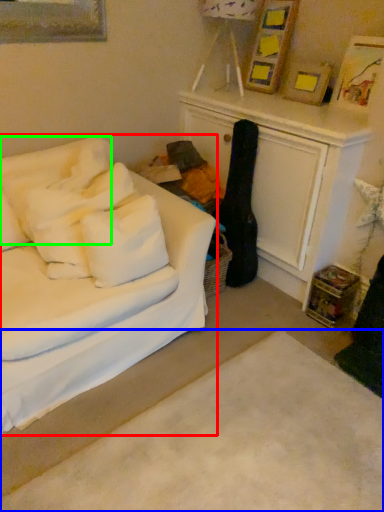
Question: Which object is positioned farthest from studio couch (highlighted by a red box)? Select from plain (highlighted by a blue box) and pillow (highlighted by a green box).

Choices:
 (A) plain
 (B) pillow

Answer: (A)